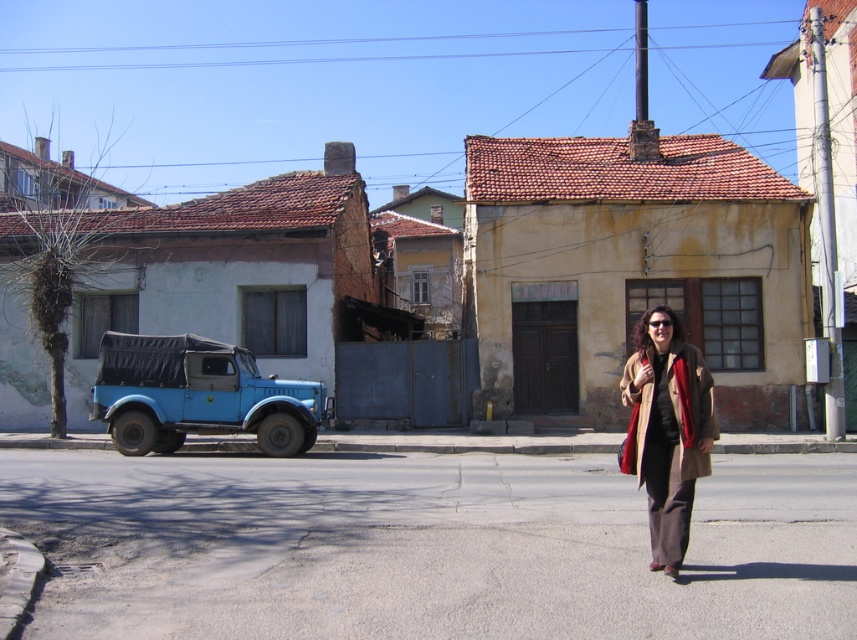
You are a photographer setting up for a shoot in this urban scene. You need to ensure the blue matte jeep at left is fully visible in the photo without being blocked by the beige wool coat at center. Based on their positions, is this possible?

The blue matte jeep at left is positioned under the beige wool coat at center, so adjusting the camera angle or moving the coat slightly might be necessary to ensure the jeep is fully visible without obstruction.

You are a delivery person carrying a package that requires a 10 meter clearance to safely pass through a narrow alleyway. You see the blue matte jeep at left and the beige wool coat at center in the scene. Can you safely navigate the alleyway between them?

The distance between the blue matte jeep at left and the beige wool coat at center is 11.54 meters, which is greater than the required 10 meter clearance. Therefore, you can safely navigate the alleyway between them.

Looking at this image, you are a photographer setting up a shot in this urban scene. You need to position a 1.5 meter wide backdrop behind the blue matte jeep at left and the beige wool coat at center. Which object requires the backdrop to be placed further back to accommodate its width?

The blue matte jeep at left requires the backdrop to be placed further back because its width surpasses that of the beige wool coat at center.